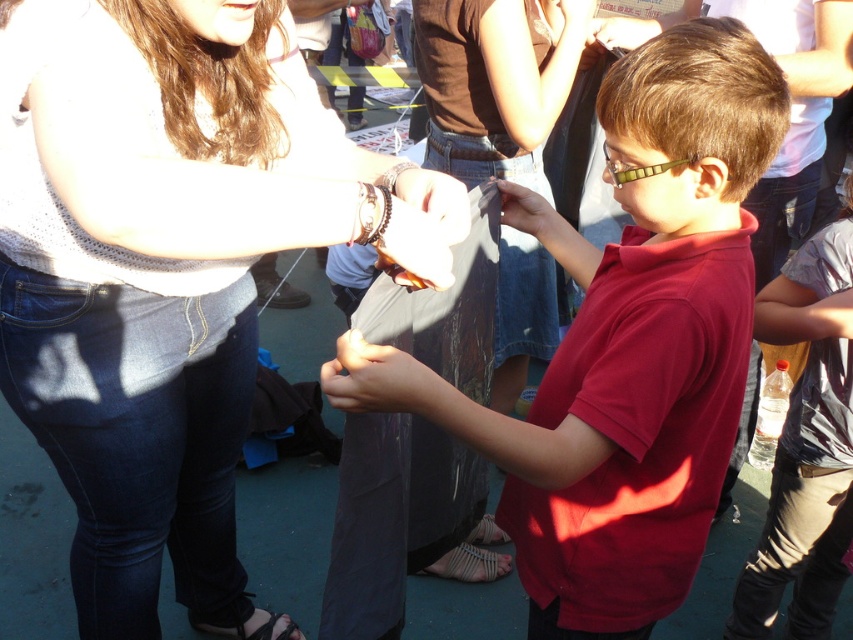
Can you confirm if matte black umbrella at center is bigger than white woven sandal at lower center?

Incorrect, matte black umbrella at center is not larger than white woven sandal at lower center.

Find the location of a particular element. Image resolution: width=853 pixels, height=640 pixels. matte black umbrella at center is located at coordinates (527, 212).

Find the location of `matte black umbrella at center`. matte black umbrella at center is located at coordinates (527, 212).

Between knitted white sweater at upper left and black leather sandal at lower left, which one is positioned higher?

knitted white sweater at upper left is higher up.

Can you confirm if knitted white sweater at upper left is positioned above black leather sandal at lower left?

Indeed, knitted white sweater at upper left is positioned over black leather sandal at lower left.

The height and width of the screenshot is (640, 853). In order to click on knitted white sweater at upper left in this screenshot , I will do 167,268.

The width and height of the screenshot is (853, 640). Find the location of `knitted white sweater at upper left`. knitted white sweater at upper left is located at coordinates (167, 268).

Consider the image. How far apart are knitted white sweater at upper left and matte black umbrella at center?

knitted white sweater at upper left is 25.59 inches from matte black umbrella at center.

Is knitted white sweater at upper left closer to the viewer compared to matte black umbrella at center?

Yes, it is in front of matte black umbrella at center.

Does point (178, 502) come behind point (526, 193)?

Yes, it is.

At what (x,y) coordinates should I click in order to perform the action: click on knitted white sweater at upper left. Please return your answer as a coordinate pair (x, y). Image resolution: width=853 pixels, height=640 pixels. Looking at the image, I should click on click(167, 268).